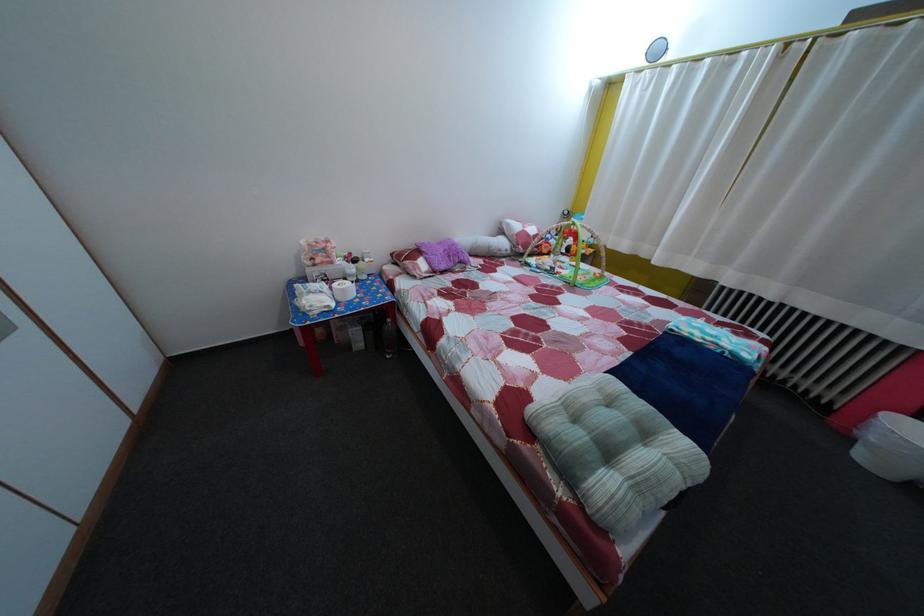
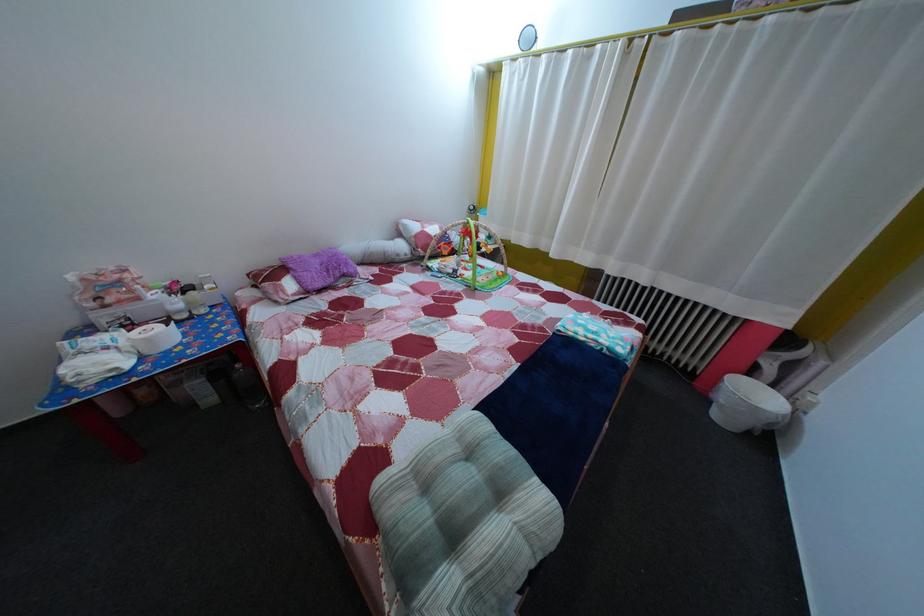
Where in the second image is the point corresponding to [398,328] from the first image?

(248, 374)